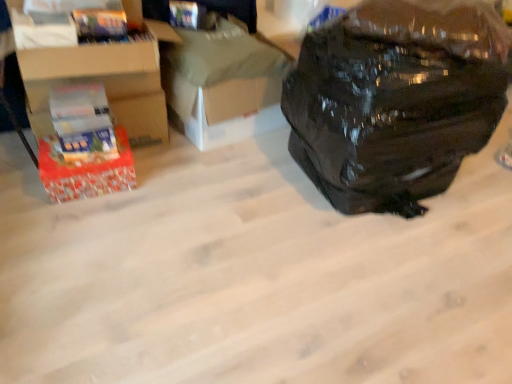
This screenshot has height=384, width=512. I want to click on vacant area that is situated to the right of red cardboard box at left, so click(x=156, y=191).